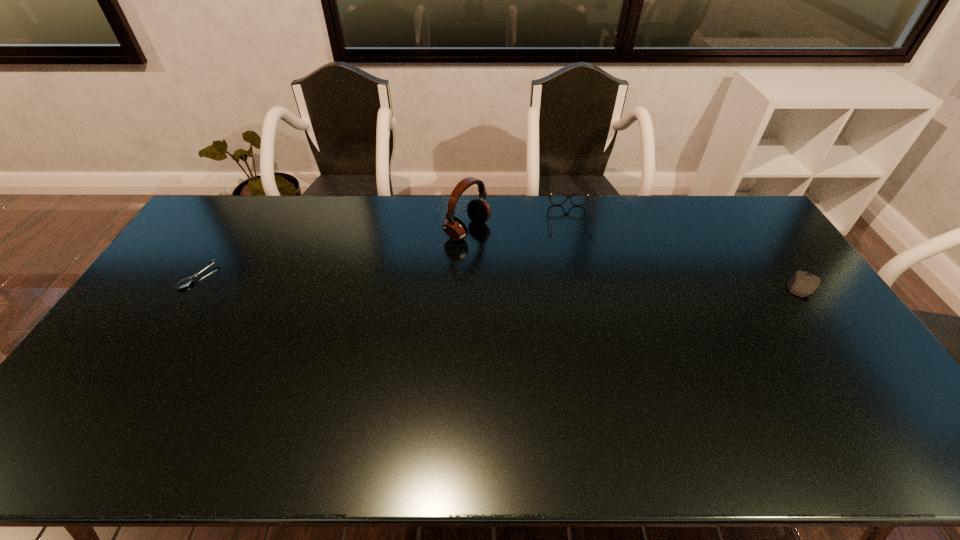
The image size is (960, 540). I want to click on free space at the far edge of the desktop, so click(x=331, y=220).

Locate an element on the screen. free space at the near edge of the desktop is located at coordinates (562, 399).

In order to click on vacant space at the left edge of the desktop in this screenshot , I will do `click(127, 348)`.

This screenshot has width=960, height=540. Identify the location of free region at the right edge of the desktop. (820, 354).

Find the location of `vacant region at the far right corner`. vacant region at the far right corner is located at coordinates (724, 227).

I want to click on free space between the leftmost object and the spectacles, so click(x=384, y=248).

This screenshot has width=960, height=540. Identify the location of free spot between the second object from right to left and the tallest object. pyautogui.click(x=518, y=225).

Find the location of a particular element. vacant region between the tallest object and the shortest object is located at coordinates (332, 253).

This screenshot has height=540, width=960. What are the coordinates of `free space between the shortest object and the third shortest object` in the screenshot? It's located at (384, 248).

Identify the location of empty space that is in between the shortest object and the third object from right to left. (332, 253).